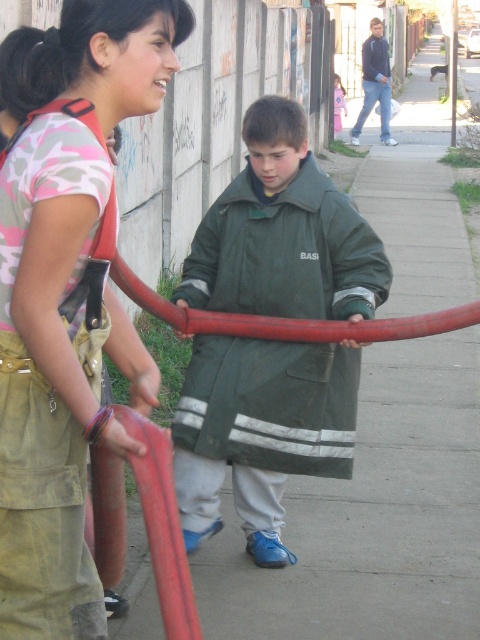
Question: Which object appears farthest from the camera in this image?

Choices:
 (A) green matte jacket at center
 (B) camouflage fabric shirt at center

Answer: (A)

Question: Considering the relative positions of camouflage fabric shirt at center and green matte jacket at center in the image provided, where is camouflage fabric shirt at center located with respect to green matte jacket at center?

Choices:
 (A) right
 (B) left

Answer: (B)

Question: Can you confirm if camouflage fabric shirt at center is bigger than green matte jacket at center?

Choices:
 (A) no
 (B) yes

Answer: (A)

Question: Which of the following is the farthest from the observer?

Choices:
 (A) camouflage fabric shirt at center
 (B) green matte jacket at center

Answer: (B)

Question: Can you confirm if camouflage fabric shirt at center is wider than green matte jacket at center?

Choices:
 (A) yes
 (B) no

Answer: (B)